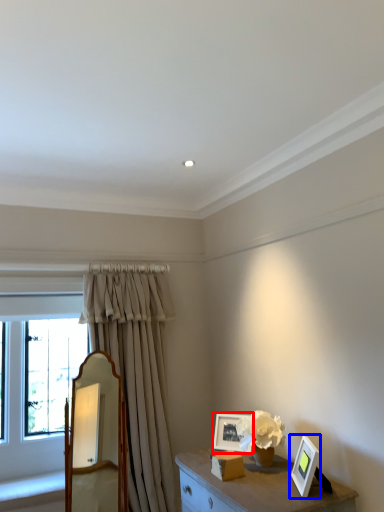
Question: Which object appears farthest to the camera in this image, picture frame (highlighted by a red box) or picture frame (highlighted by a blue box)?

Choices:
 (A) picture frame
 (B) picture frame

Answer: (A)